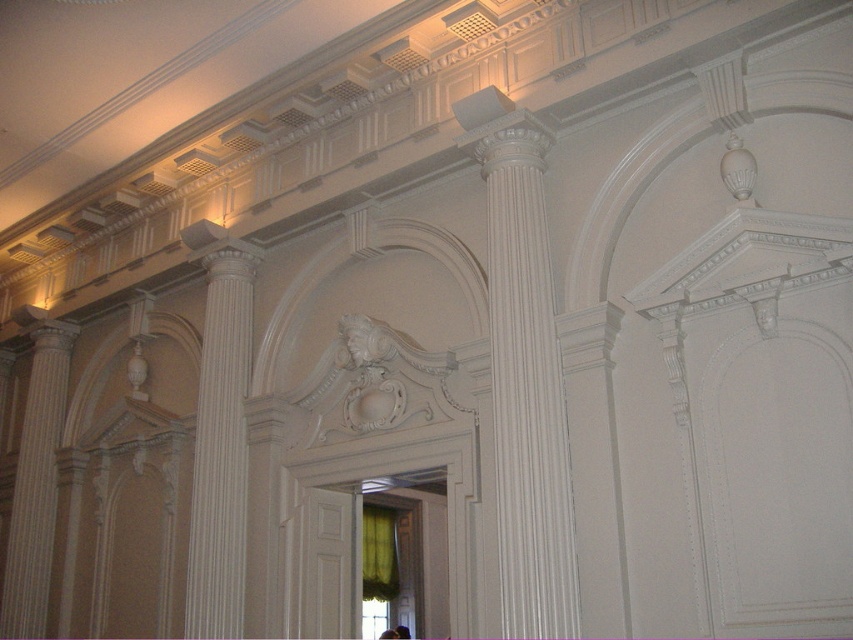
Question: Can you confirm if white smooth column at center is positioned below white glossy column at left?

Choices:
 (A) yes
 (B) no

Answer: (B)

Question: Does white glossy column at center come behind white smooth column at center?

Choices:
 (A) no
 (B) yes

Answer: (A)

Question: Which point is closer to the camera?

Choices:
 (A) white smooth column at center
 (B) white glossy column at center

Answer: (B)

Question: Based on their relative distances, which object is nearer to the white glossy column at left?

Choices:
 (A) white smooth column at center
 (B) white glossy column at center

Answer: (A)

Question: Which point is farther from the camera taking this photo?

Choices:
 (A) (33, 529)
 (B) (560, 513)

Answer: (A)

Question: Does white glossy column at center have a lesser width compared to white smooth column at center?

Choices:
 (A) no
 (B) yes

Answer: (A)